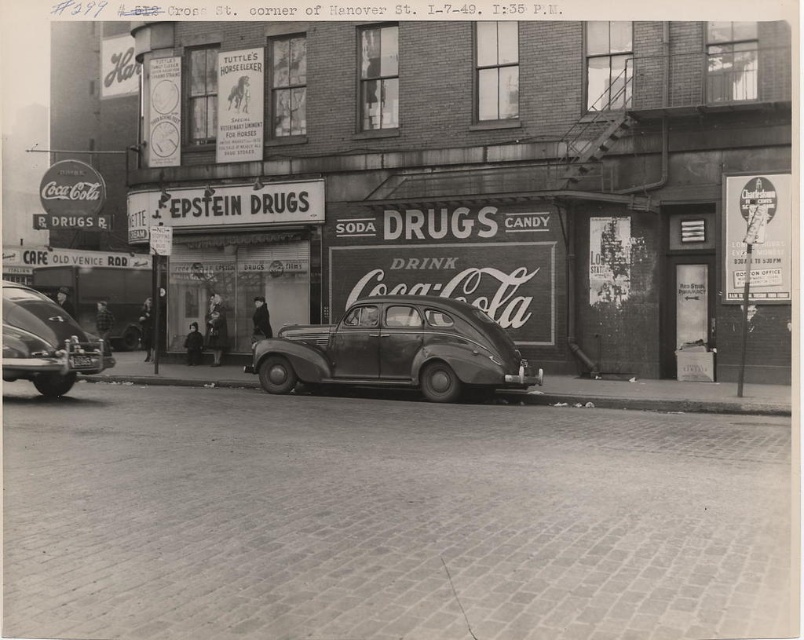
Question: Which object is closer to the camera taking this photo?

Choices:
 (A) shiny dark gray car at center
 (B) shiny chrome car at left

Answer: (B)

Question: Can you confirm if shiny dark gray car at center is thinner than shiny chrome car at left?

Choices:
 (A) yes
 (B) no

Answer: (B)

Question: Which point is farther to the camera?

Choices:
 (A) shiny chrome car at left
 (B) shiny dark gray car at center

Answer: (B)

Question: Is shiny dark gray car at center further to the viewer compared to shiny chrome car at left?

Choices:
 (A) yes
 (B) no

Answer: (A)

Question: Does shiny dark gray car at center have a larger size compared to shiny chrome car at left?

Choices:
 (A) no
 (B) yes

Answer: (B)